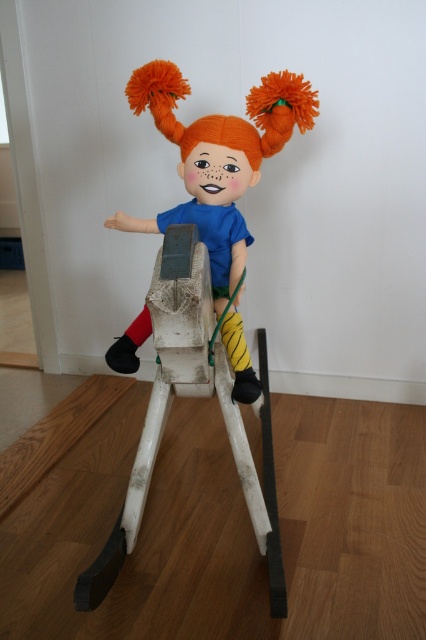
You are a toy organizer trying to place the knitted orange doll at center and the white matte wooden rocking horse at center on a shelf. The shelf has a width of 1 meter. Knowing that the doll is wider than the rocking horse, can both items fit side by side on the shelf without overlapping?

The knitted orange doll at center is wider than the white matte wooden rocking horse at center. However, since the shelf is 1 meter wide, both items can fit side by side as long as their combined widths do not exceed 1 meter. The exact dimensions are not provided, so it depends on their total width.

You are taking a photo of the scene and want to focus on both the point at (175, 124) and the point at (267, 440). Which point should you adjust your focus to first to ensure both are in focus?

Point at (175, 124) is closer to the camera than point at (267, 440). To ensure both are in focus, you should focus on the closer point first, which is point at (175, 124).

The knitted orange doll at center is placed on a white wooden rocking horse. If you were to draw a straight line from the doll to the bottom edge of the image, would it land closer to the left or right side of the image?

The 2D location of the knitted orange doll at center is at point (218, 157). Since the x coordinate is 0.248, which is less than 0.5, the vertical line from the doll would land closer to the left side of the image.